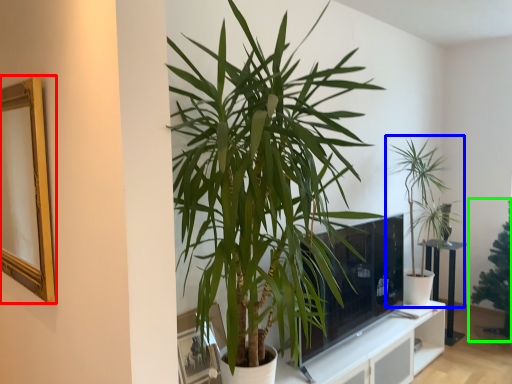
Question: Considering the real-world distances, which object is closest to picture frame (highlighted by a red box)? houseplant (highlighted by a blue box) or houseplant (highlighted by a green box).

Choices:
 (A) houseplant
 (B) houseplant

Answer: (A)